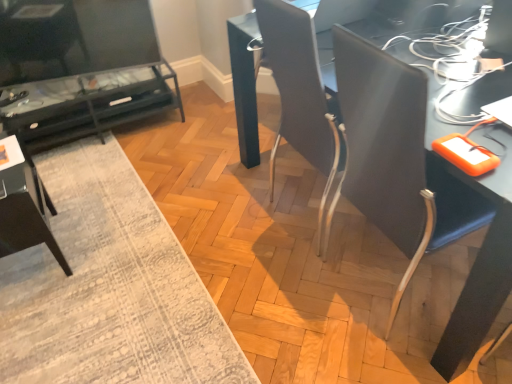
Question: In the image, is matte black tv stand at left, which ranks as the 2th table in front-to-back order, on the left side or the right side of textured gray rug at lower left?

Choices:
 (A) right
 (B) left

Answer: (B)

Question: From a real-world perspective, relative to textured gray rug at lower left, is matte black tv stand at left, which ranks as the 2th table in front-to-back order, vertically above or below?

Choices:
 (A) above
 (B) below

Answer: (A)

Question: Which is nearer to the dark gray fabric armchair at lower left?

Choices:
 (A) matte black table at center, which is the first table from front to back
 (B) textured gray rug at lower left
 (C) matte black desk at center
 (D) matte black tv stand at left, which ranks as the first table in left-to-right order

Answer: (B)

Question: Which is nearer to the textured gray rug at lower left?

Choices:
 (A) matte black desk at center
 (B) dark gray fabric armchair at lower left
 (C) matte black tv stand at left, which ranks as the first table in left-to-right order
 (D) matte black table at center, which ranks as the second table in back-to-front order

Answer: (B)